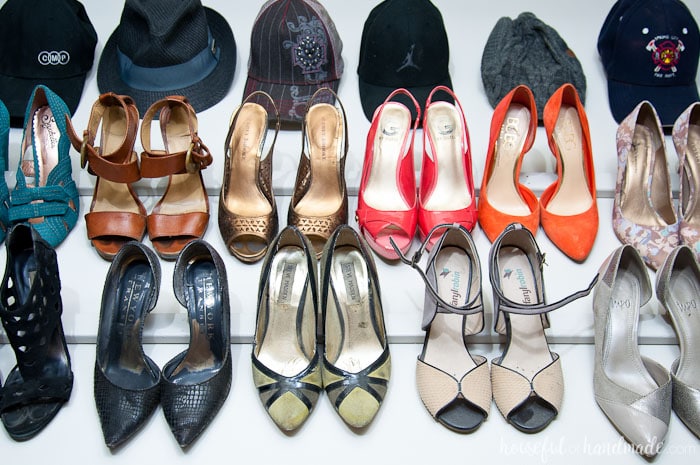
Where is `pairs of shoes`? The height and width of the screenshot is (465, 700). pairs of shoes is located at coordinates (32, 150), (194, 154), (288, 177), (412, 175), (547, 150), (662, 179), (671, 321), (472, 326), (322, 325), (139, 332).